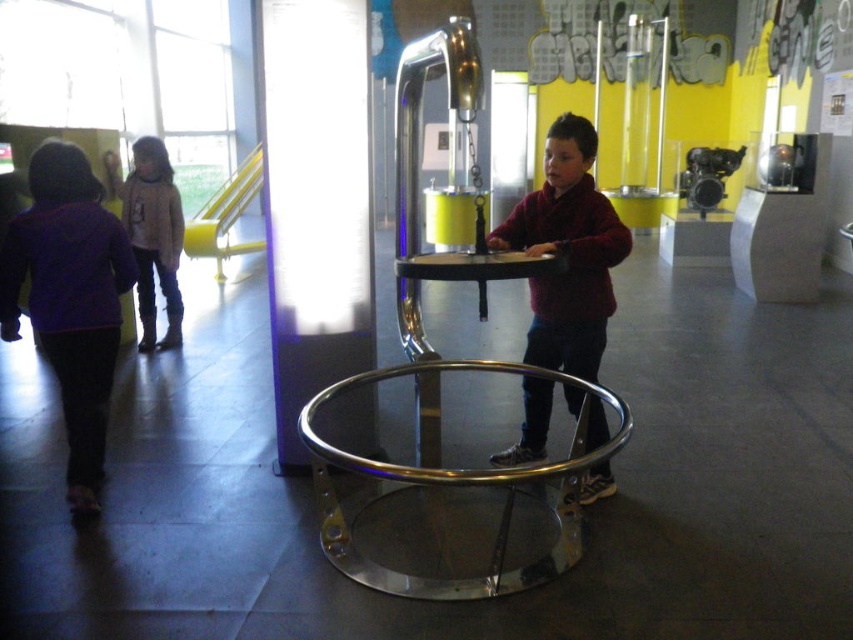
Based on the photo, does maroon sweater at center have a smaller size compared to matte gray sweater at left?

No, maroon sweater at center is not smaller than matte gray sweater at left.

Which is behind, point (573, 241) or point (163, 173)?

The point (163, 173) is behind.

Is point (567, 241) positioned behind point (178, 200)?

No.

This screenshot has height=640, width=853. Identify the location of maroon sweater at center. (567, 252).

Between purple fleece jacket at left and matte gray sweater at left, which one is positioned higher?

Positioned higher is matte gray sweater at left.

Describe the element at coordinates (70, 300) in the screenshot. I see `purple fleece jacket at left` at that location.

Image resolution: width=853 pixels, height=640 pixels. I want to click on purple fleece jacket at left, so click(70, 300).

Is polished metal round table at center to the left of matte gray sweater at left from the viewer's perspective?

In fact, polished metal round table at center is to the right of matte gray sweater at left.

Where is `polished metal round table at center`? This screenshot has height=640, width=853. polished metal round table at center is located at coordinates (451, 484).